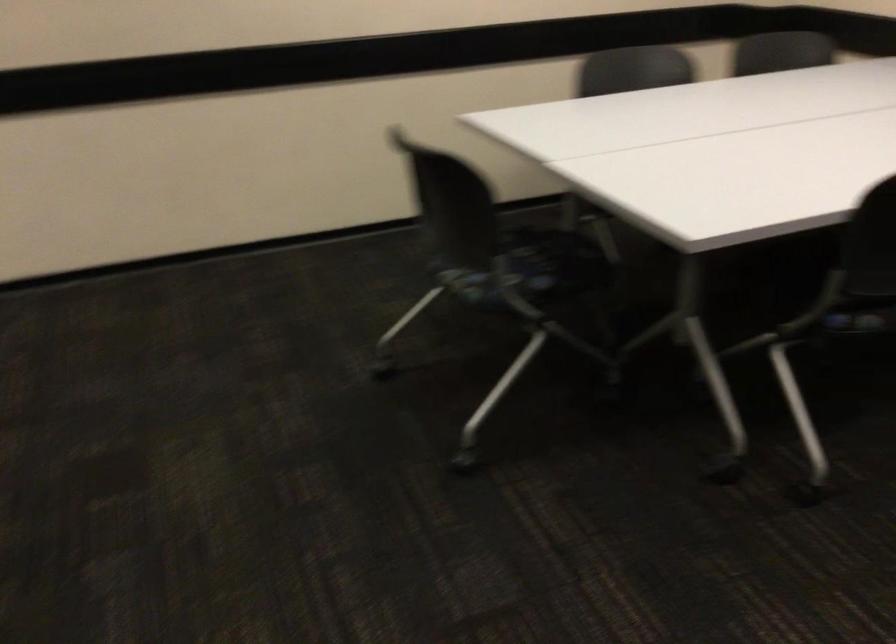
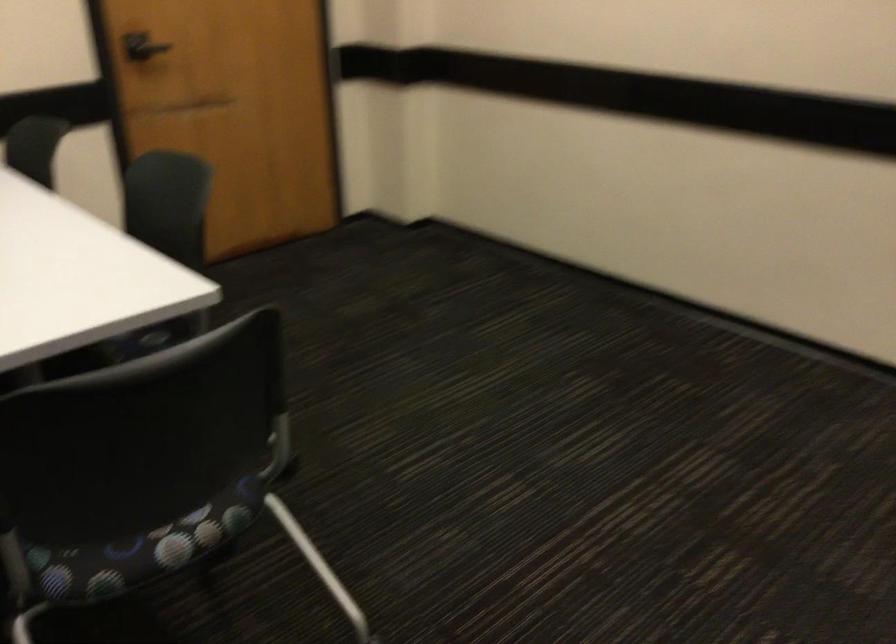
Question: The images are taken continuously from a first-person perspective. In which direction is your viewpoint rotating?

Choices:
 (A) Left
 (B) Right
 (C) Up
 (D) Down

Answer: (A)